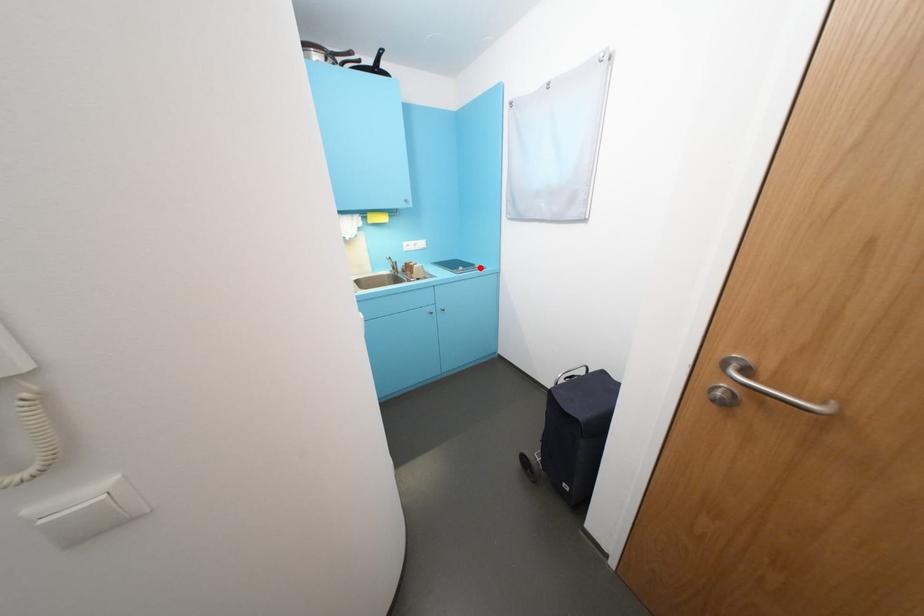
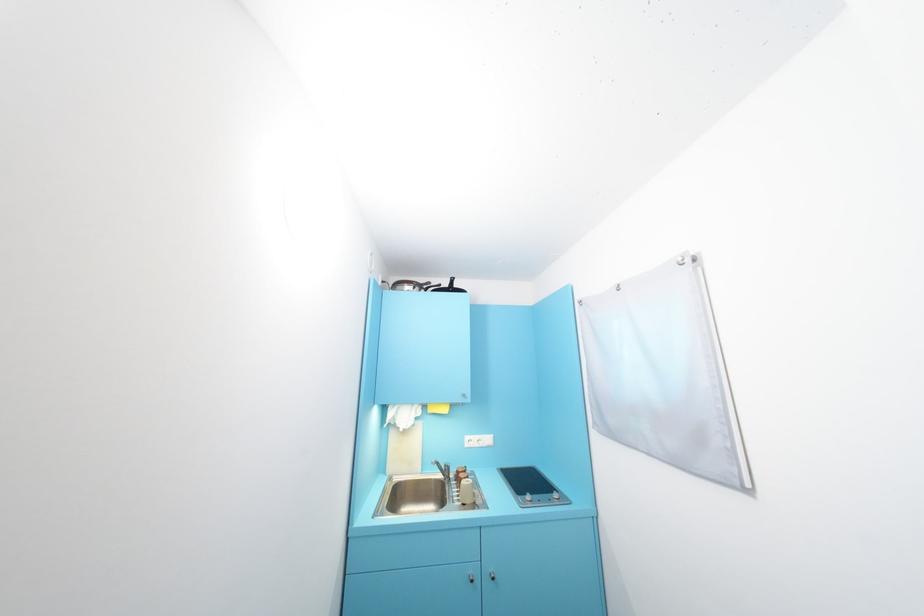
Where in the second image is the point corresponding to the highlighted location from the first image?

(557, 496)